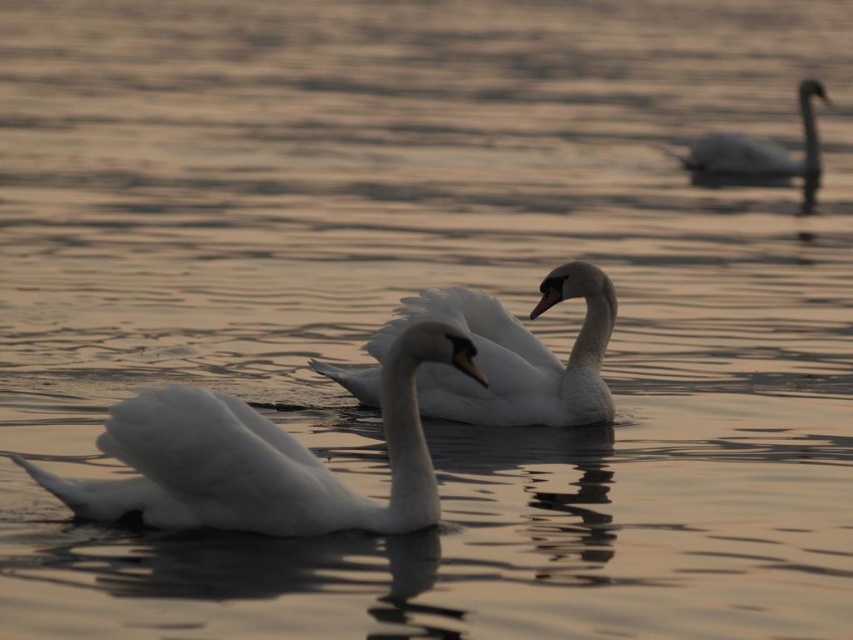
Who is more forward, [177,400] or [683,157]?

Point [177,400] is in front.

Is point (200, 509) farther from camera compared to point (798, 97)?

No, it is not.

Identify the location of white feathered swan at center. (260, 458).

You are a GUI agent. You are given a task and a screenshot of the screen. Output one action in this format:
    pyautogui.click(x=<x>, y=<y>)
    Task: Click on the white feathered swan at center
    
    Given the screenshot: What is the action you would take?
    pyautogui.click(x=260, y=458)

Between white glossy swan at center and white glossy swan at upper right, which one is positioned lower?

white glossy swan at center is lower down.

Is white glossy swan at center in front of white glossy swan at upper right?

Yes, it is.

At what (x,y) coordinates should I click in order to perform the action: click on white glossy swan at center. Please return your answer as a coordinate pair (x, y). Image resolution: width=853 pixels, height=640 pixels. Looking at the image, I should click on (514, 355).

Does point (236, 490) lie in front of point (570, 406)?

Yes.

Who is more distant from viewer, [106,480] or [492,385]?

The point [492,385] is behind.

Where is `white feathered swan at center`? The width and height of the screenshot is (853, 640). white feathered swan at center is located at coordinates (260, 458).